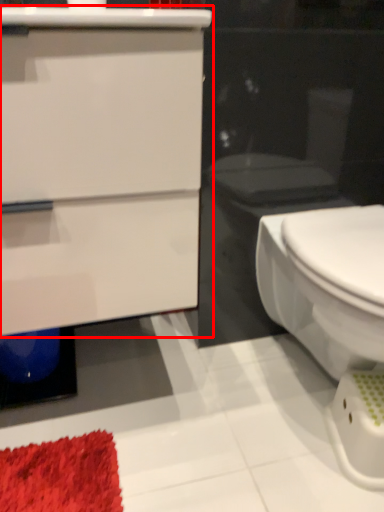
Question: Considering the relative positions of bathroom cabinet (annotated by the red box) and bidet in the image provided, where is bathroom cabinet (annotated by the red box) located with respect to the staircase?

Choices:
 (A) left
 (B) right

Answer: (A)